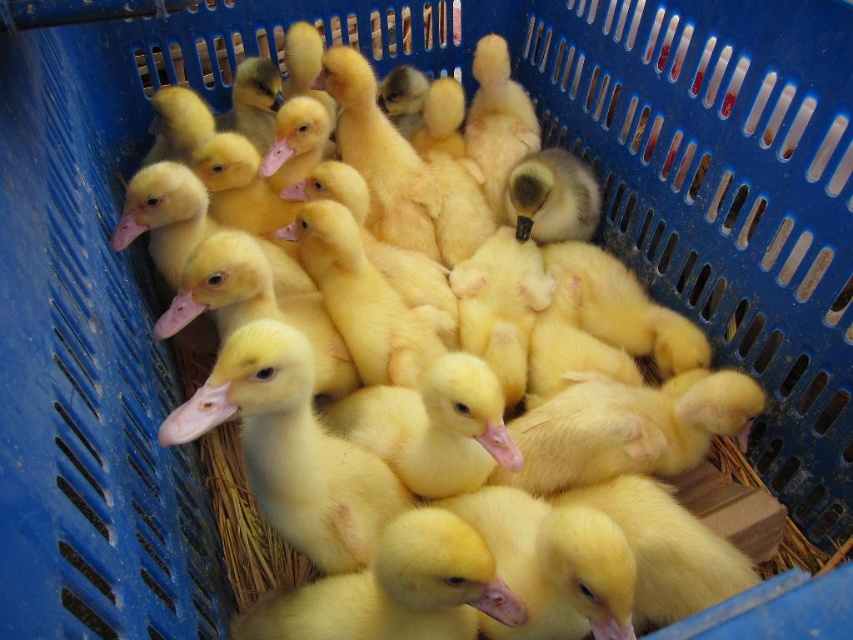
Does smooth yellow duckling at center have a larger size compared to yellow matte duckling at center?

Correct, smooth yellow duckling at center is larger in size than yellow matte duckling at center.

Who is lower down, smooth yellow duckling at center or yellow matte duckling at center?

yellow matte duckling at center

Between point (281, 474) and point (370, 627), which one is positioned behind?

Positioned behind is point (281, 474).

You are a GUI agent. You are given a task and a screenshot of the screen. Output one action in this format:
    pyautogui.click(x=<x>, y=<y>)
    Task: Click on the smooth yellow duckling at center
    The width and height of the screenshot is (853, 640).
    Given the screenshot: What is the action you would take?
    pyautogui.click(x=291, y=448)